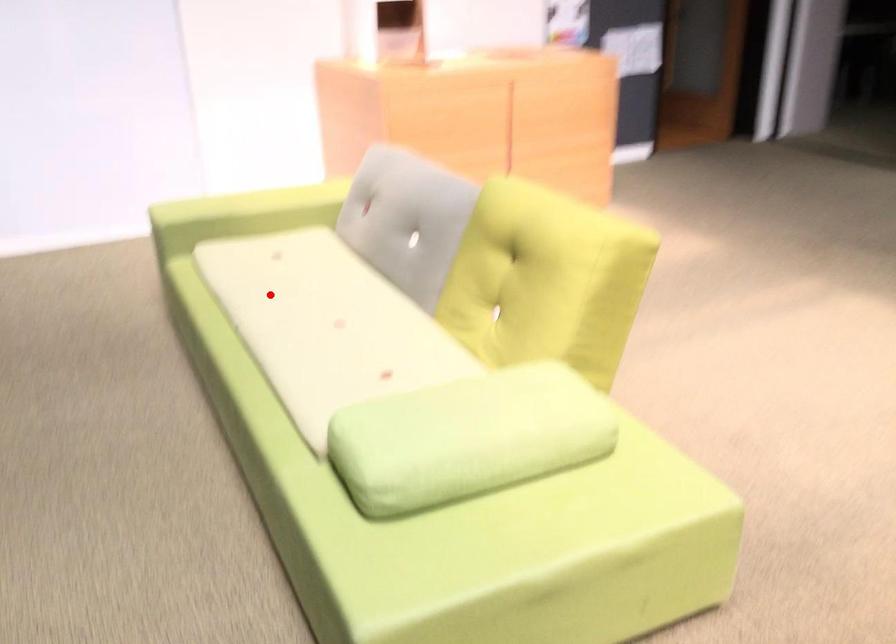
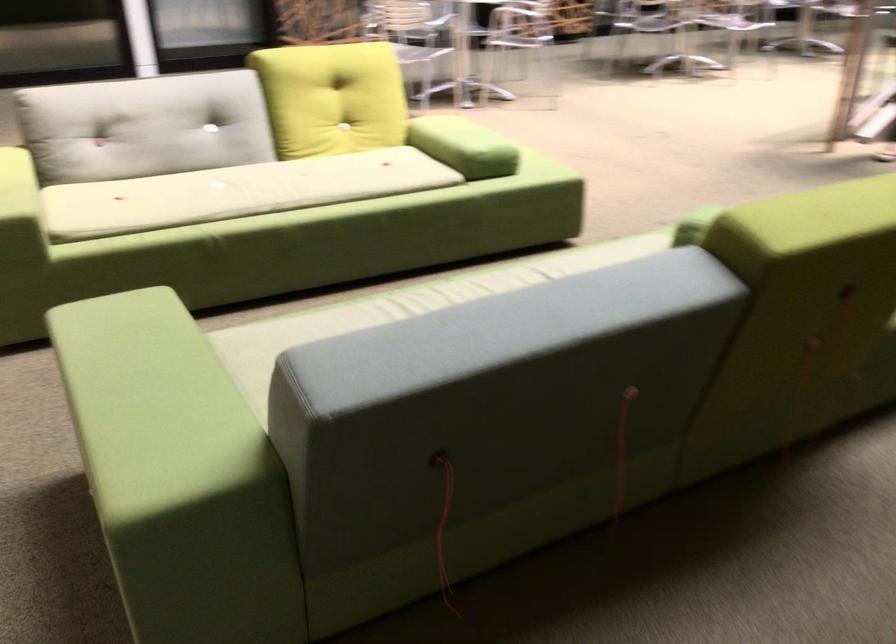
Where in the second image is the point corresponding to the highlighted location from the first image?

(236, 192)